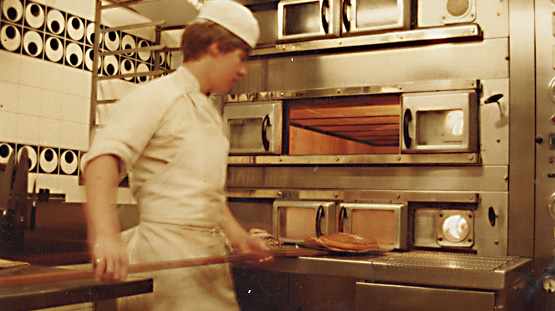
The width and height of the screenshot is (555, 311). Find the location of `oven`. oven is located at coordinates (352, 137).